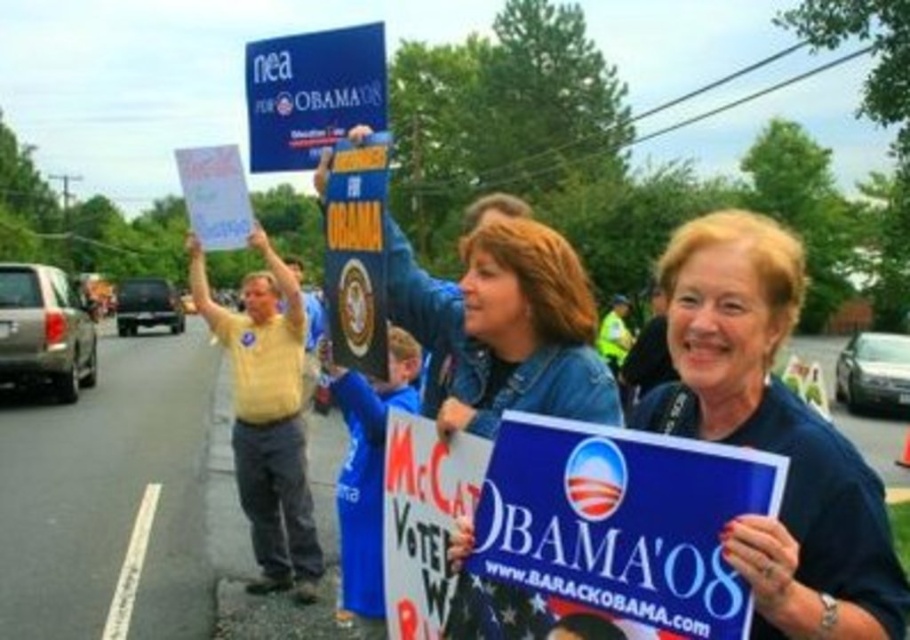
Question: Can you confirm if yellow shirt at center is positioned to the left of blue plastic sign at upper center?

Choices:
 (A) no
 (B) yes

Answer: (B)

Question: Is the position of blue fabric sign at center more distant than that of yellow shirt at center?

Choices:
 (A) yes
 (B) no

Answer: (B)

Question: Is yellow shirt at center smaller than blue plastic sign at upper center?

Choices:
 (A) no
 (B) yes

Answer: (A)

Question: Which object appears closest to the camera in this image?

Choices:
 (A) blue fabric sign at center
 (B) blue plastic sign at upper center

Answer: (A)

Question: Based on their relative distances, which object is farther from the blue fabric sign at center?

Choices:
 (A) blue plastic sign at upper center
 (B) yellow shirt at center

Answer: (B)

Question: Among these points, which one is farthest from the camera?

Choices:
 (A) (251, 67)
 (B) (703, 352)

Answer: (A)